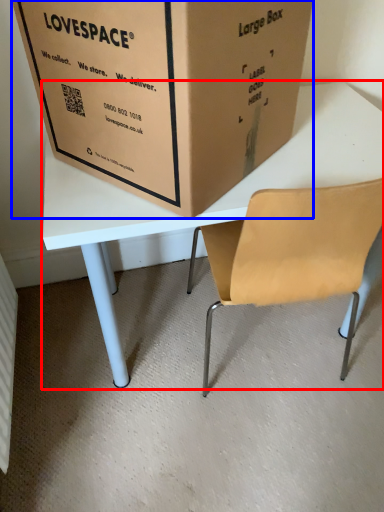
Question: Which of the following is the farthest to the observer, table (highlighted by a red box) or box (highlighted by a blue box)?

Choices:
 (A) table
 (B) box

Answer: (A)